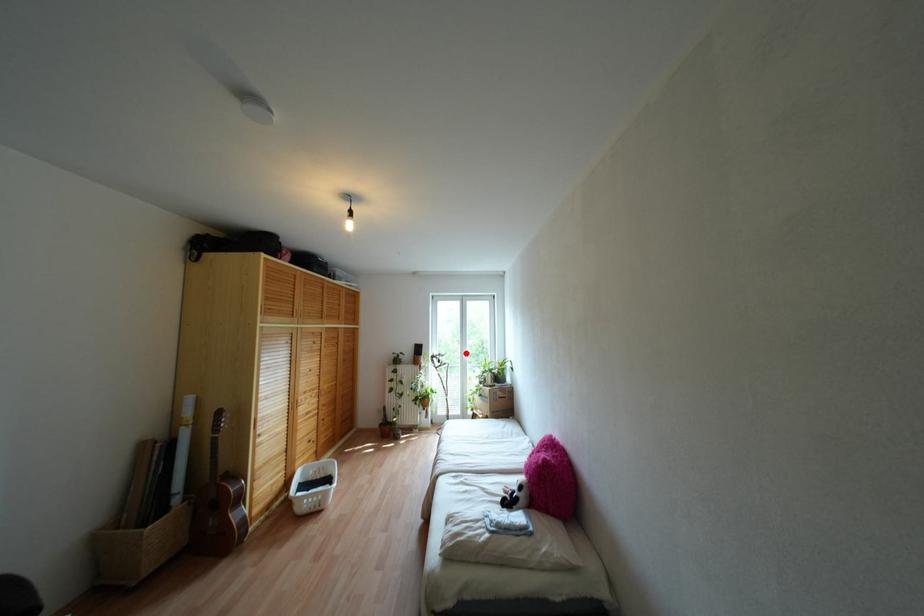
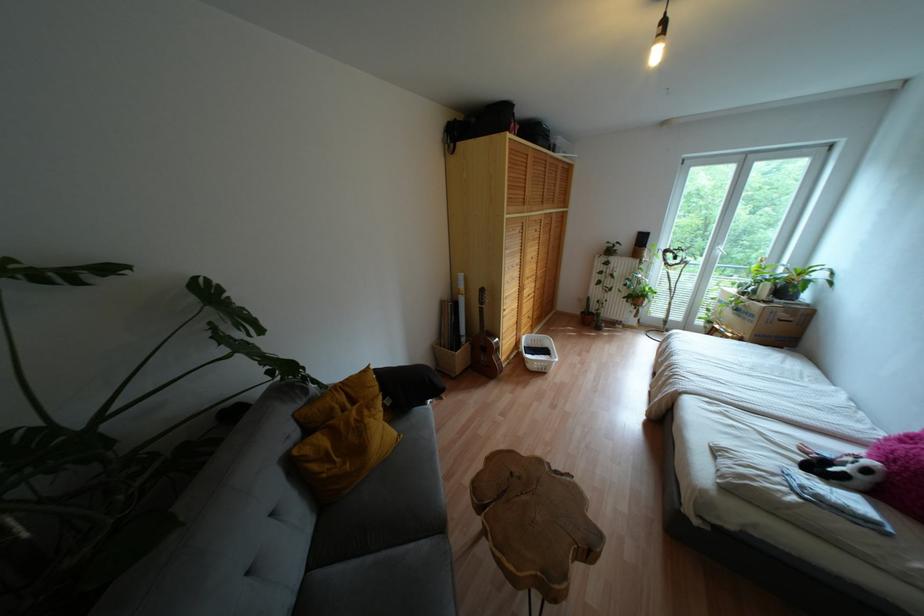
Question: A red point is marked in image1. In image2, is the corresponding 3D point closer to the camera or farther? Reply with the corresponding letter.

Choices:
 (A) The corresponding 3D point is closer.
 (B) The corresponding 3D point is farther.

Answer: (A)